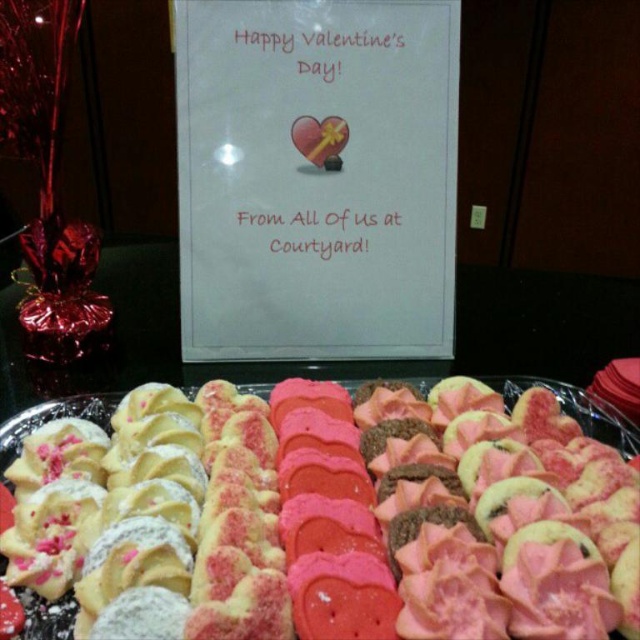
In the scene shown: Is white paper sign at upper center above pink frosted heart-shaped cookies at center?

Yes, white paper sign at upper center is above pink frosted heart-shaped cookies at center.

Is point (225, 225) closer to viewer compared to point (602, 420)?

No, it is not.

Who is more distant from viewer, (340, 292) or (22, 417)?

Positioned behind is point (340, 292).

Find the location of a particular element. The height and width of the screenshot is (640, 640). white paper sign at upper center is located at coordinates (316, 177).